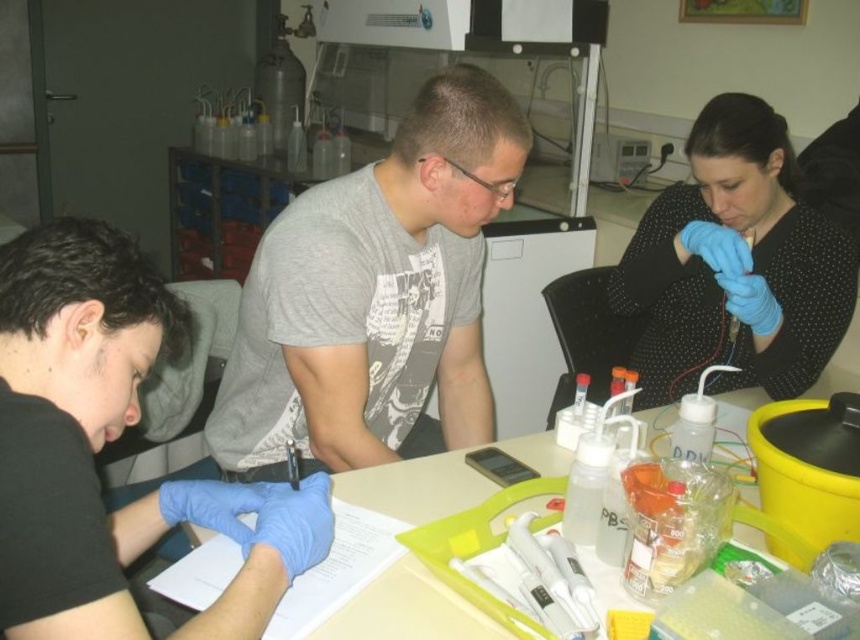
You are standing in the laboratory and want to pick up the object at point (65, 412). Can you reach it without moving closer?

The point (65, 412) is 30.34 inches from the camera. Since the average human arm length is about 25 inches, you cannot reach it without moving closer.